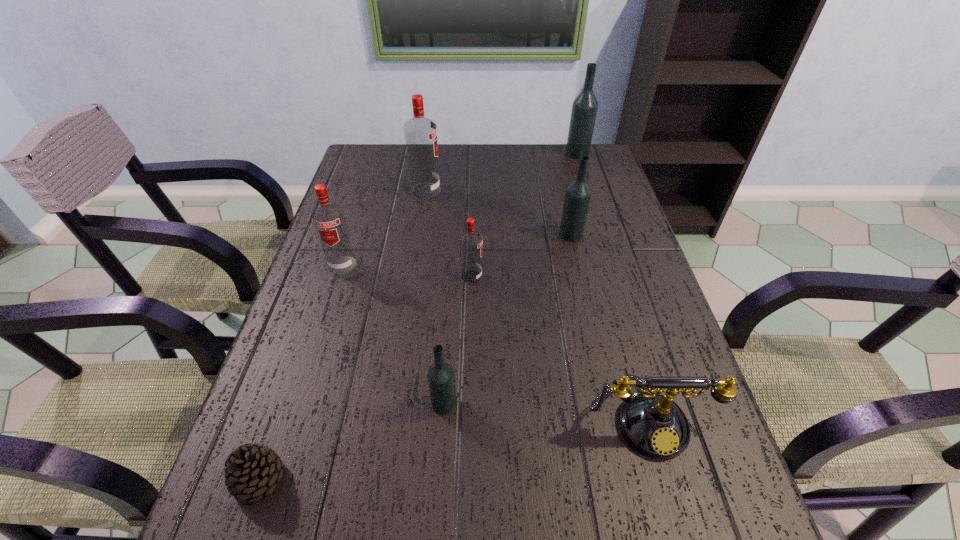
Locate an element on the screen. This screenshot has width=960, height=540. vacant space that satisfies the following two spatial constraints: 1. on the front label of the nearest vodka; 2. on the left side of the leftmost vodka is located at coordinates pyautogui.click(x=299, y=403).